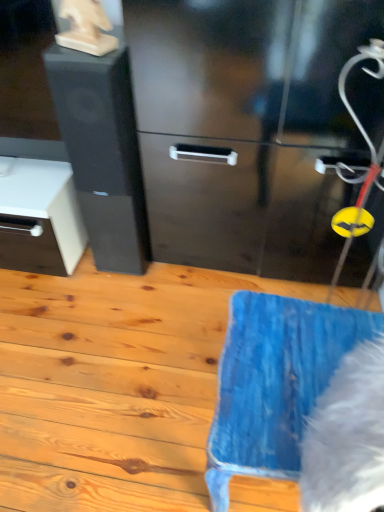
Question: Considering the relative positions of white fluffy animal at lower right and blue fabric at lower right in the image provided, is white fluffy animal at lower right to the left or to the right of blue fabric at lower right?

Choices:
 (A) right
 (B) left

Answer: (A)

Question: Choose the correct answer: Is white fluffy animal at lower right inside blue fabric at lower right or outside it?

Choices:
 (A) inside
 (B) outside

Answer: (B)

Question: Based on their relative distances, which object is nearer to the blue fabric at lower right?

Choices:
 (A) black matte/file cabinet at left
 (B) white fluffy animal at lower right

Answer: (A)

Question: Which is farther from the white fluffy animal at lower right?

Choices:
 (A) blue fabric at lower right
 (B) black matte/file cabinet at left

Answer: (B)